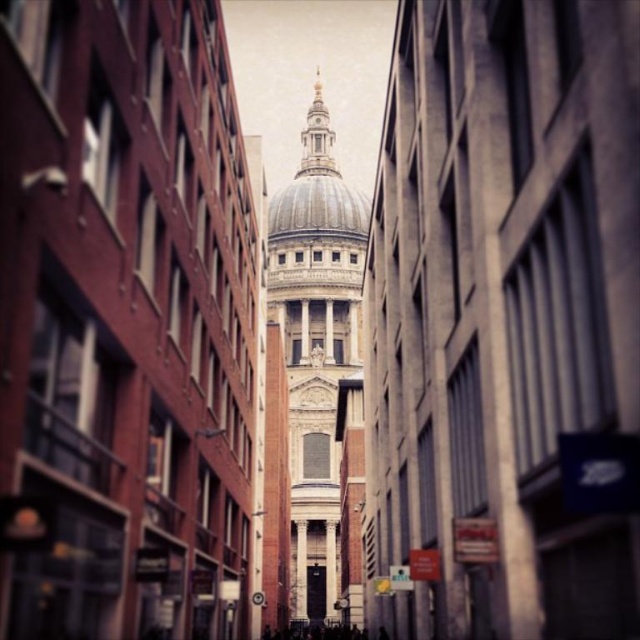
You are an architect analyzing the structural integrity of the buildings in the scene. Given that the white marble tower at center and smooth stone dome at center are both made of stone, which one would you expect to be more prone to cracking due to wind pressure? Explain your reasoning based on their shapes.

→ The white marble tower at center is thinner than the smooth stone dome at center. Due to its narrower profile, the white marble tower at center would likely experience more stress from wind pressure, making it more prone to cracking compared to the broader and more stable smooth stone dome at center.

You are standing in the narrow alleyway between the two tall buildings. You see the white marble tower at center and the white marble dome at center. Which one appears closer to you?

The white marble tower at center is in front of the white marble dome at center, so it appears closer to you.

You are a tourist standing in the alleyway looking towards St. Paul Cathedral. You see the white marble tower at center and the smooth stone dome at center. Which one is closer to you?

The white marble tower at center is closer to you because it is in front of the smooth stone dome at center.